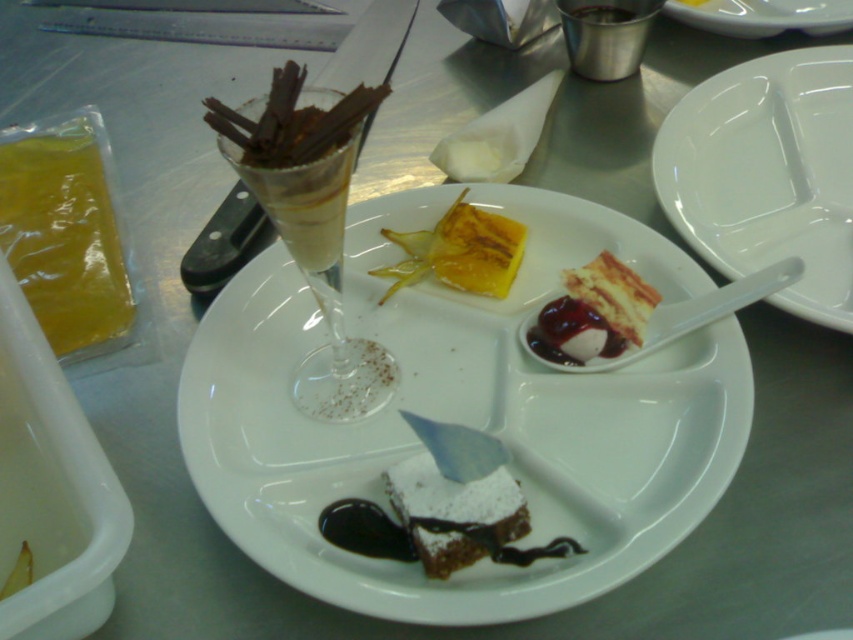
Question: Which object appears closest to the camera in this image?

Choices:
 (A) white glossy plate at upper right
 (B) white matte plate at center
 (C) clear plastic spoon at upper right
 (D) yellow gelatinous slice at center

Answer: (B)

Question: Among these points, which one is nearest to the camera?

Choices:
 (A) 424,529
 (B) 643,298
 (C) 281,180
 (D) 726,74

Answer: (C)

Question: Can you confirm if white glossy plate at upper right is positioned above powdered brownie at center?

Choices:
 (A) yes
 (B) no

Answer: (A)

Question: Which point appears closest to the camera in this image?

Choices:
 (A) (723, 0)
 (B) (601, 294)
 (C) (436, 248)

Answer: (B)

Question: Is white glossy plate at upper right smaller than smooth white cake at center?

Choices:
 (A) yes
 (B) no

Answer: (B)

Question: Is clear glass wine glass at center above clear plastic spoon at upper right?

Choices:
 (A) yes
 (B) no

Answer: (A)